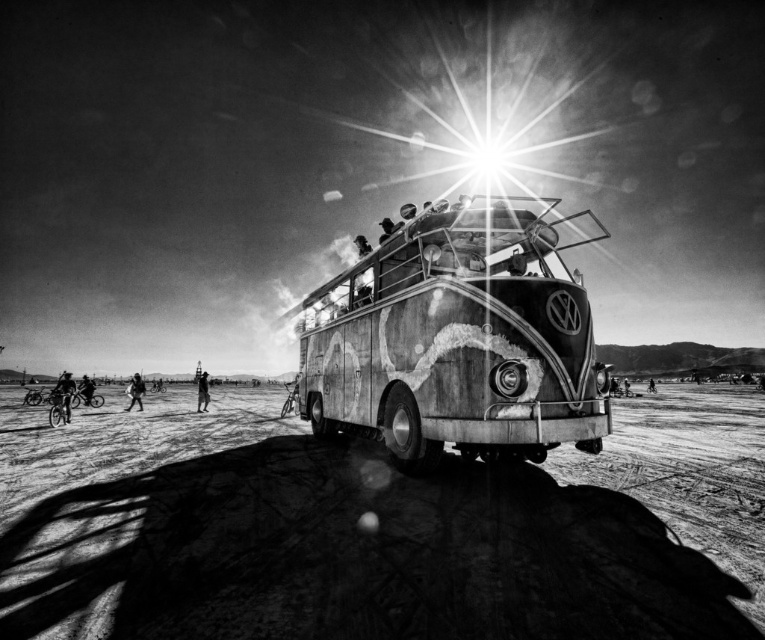
Question: Among these points, which one is farthest from the camera?

Choices:
 (A) (54, 387)
 (B) (392, 410)
 (C) (77, 394)
 (D) (352, 547)

Answer: (A)

Question: Can you confirm if dark skin bicycle rider at lower left is positioned to the left of dark fabric bicycle at lower left?

Choices:
 (A) no
 (B) yes

Answer: (A)

Question: Among these objects, which one is nearest to the camera?

Choices:
 (A) dark skin bicycle rider at lower left
 (B) rusty metal van at center

Answer: (B)

Question: Is dark skin bicycle rider at lower left closer to camera compared to distressed denim pants at center?

Choices:
 (A) no
 (B) yes

Answer: (B)

Question: Which point is farther to the camera?

Choices:
 (A) (138, 392)
 (B) (49, 419)
 (C) (153, 444)

Answer: (A)

Question: Is dusty sand at center below dark fabric bicycle at lower left?

Choices:
 (A) yes
 (B) no

Answer: (B)